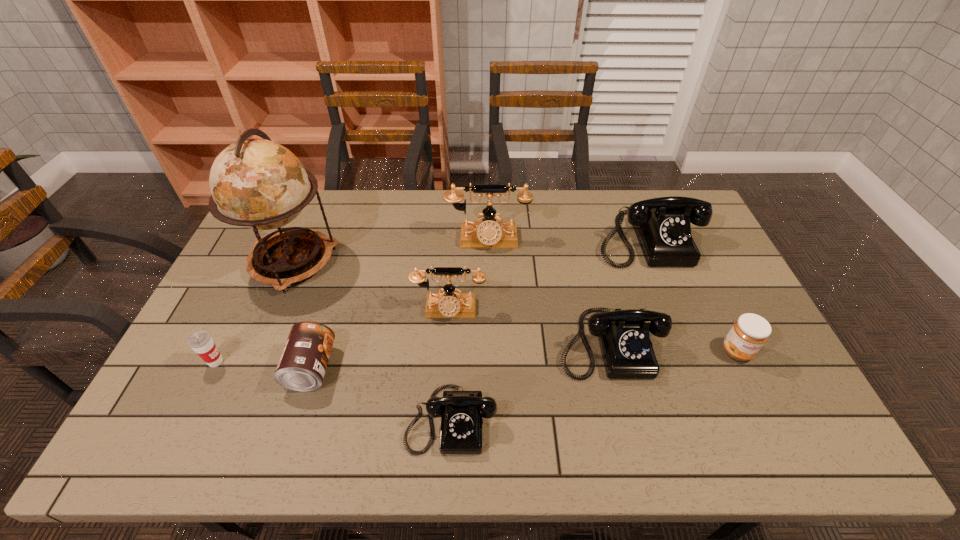
Image resolution: width=960 pixels, height=540 pixels. What are the coordinates of `object at the near edge` in the screenshot? It's located at (461, 412).

Identify the location of globe situated at the left edge. (257, 183).

The width and height of the screenshot is (960, 540). Identify the location of cup that is positioned at the left edge. (201, 342).

At what (x,y) coordinates should I click in order to perform the action: click on telephone that is at the right edge. Please return your answer as a coordinate pair (x, y). The height and width of the screenshot is (540, 960). Looking at the image, I should click on (662, 225).

Locate an element on the screen. The height and width of the screenshot is (540, 960). jam present at the right edge is located at coordinates (749, 333).

The image size is (960, 540). I want to click on object that is positioned at the far right corner, so click(662, 225).

The width and height of the screenshot is (960, 540). I want to click on free space at the far edge, so click(x=431, y=219).

The height and width of the screenshot is (540, 960). In order to click on vacant space at the near edge of the desktop in this screenshot , I will do pos(555,433).

I want to click on vacant area at the left edge, so click(x=255, y=303).

The image size is (960, 540). In the image, there is a desktop. Identify the location of vacant region at the far right corner. (690, 224).